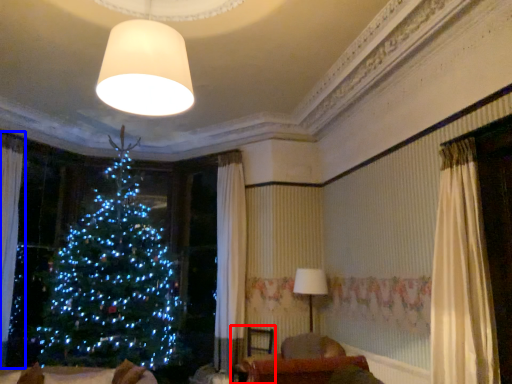
Question: Which point is further to the camera, armchair (highlighted by a red box) or curtain (highlighted by a blue box)?

Choices:
 (A) armchair
 (B) curtain

Answer: (A)